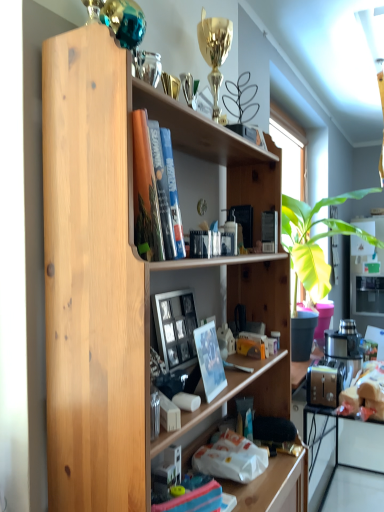
Question: Is the position of matte white photo frame at center less distant than that of natural wood bookshelf at center?

Choices:
 (A) yes
 (B) no

Answer: (B)

Question: Is matte white photo frame at center to the left of natural wood bookshelf at center from the viewer's perspective?

Choices:
 (A) yes
 (B) no

Answer: (A)

Question: Is matte white photo frame at center directly adjacent to natural wood bookshelf at center?

Choices:
 (A) yes
 (B) no

Answer: (B)

Question: Is natural wood bookshelf at center a part of matte white photo frame at center?

Choices:
 (A) yes
 (B) no

Answer: (B)

Question: Does matte white photo frame at center lie behind natural wood bookshelf at center?

Choices:
 (A) no
 (B) yes

Answer: (B)

Question: In the image, is white glossy computer at lower right on the left side or the right side of matte white photo frame at center?

Choices:
 (A) right
 (B) left

Answer: (A)

Question: Is white glossy computer at lower right taller or shorter than matte white photo frame at center?

Choices:
 (A) tall
 (B) short

Answer: (B)

Question: From a real-world perspective, is white glossy computer at lower right positioned above or below matte white photo frame at center?

Choices:
 (A) above
 (B) below

Answer: (B)

Question: From the image's perspective, is white glossy computer at lower right positioned above or below matte white photo frame at center?

Choices:
 (A) below
 (B) above

Answer: (A)

Question: In terms of size, does natural wood bookshelf at center appear bigger or smaller than wooden picture frame at center?

Choices:
 (A) big
 (B) small

Answer: (A)

Question: Is point (117, 90) closer or farther from the camera than point (180, 323)?

Choices:
 (A) closer
 (B) farther

Answer: (A)

Question: From a real-world perspective, is natural wood bookshelf at center above or below wooden picture frame at center?

Choices:
 (A) below
 (B) above

Answer: (A)

Question: Based on their positions, is natural wood bookshelf at center located to the left or right of wooden picture frame at center?

Choices:
 (A) right
 (B) left

Answer: (A)

Question: Is wooden picture frame at center inside the boundaries of matte white photo frame at center, or outside?

Choices:
 (A) outside
 (B) inside

Answer: (A)

Question: Is point (175, 333) closer or farther from the camera than point (208, 377)?

Choices:
 (A) closer
 (B) farther

Answer: (B)